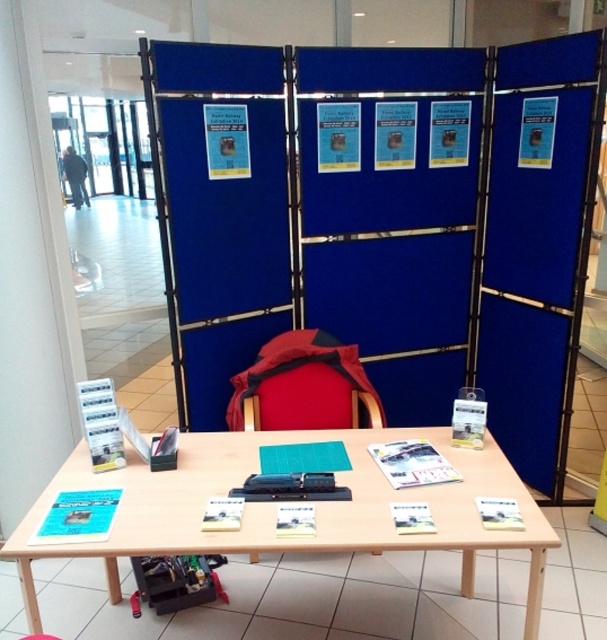
You are a visitor at the event and need to sit down. You see a red fabric chair at center and a pink plastic stool at lower center. Which one is positioned higher from the ground?

The red fabric chair at center is located above the pink plastic stool at lower center, so the red fabric chair at center is higher from the ground.

You are a person who wants to sit down to read the brochures on the table. Which seat, the red fabric chair at center or the pink plastic stool at lower center, would be more comfortable for sitting at the table?

The red fabric chair at center is taller than the pink plastic stool at lower center, so it may provide a more comfortable seating height to reach the table.

You are a visitor at the exhibition hall and want to sit down to look at the items on the wooden table at center. Is the pink plastic stool at lower center positioned in a way that you can easily reach the table from the stool?

The wooden table at center is located above the pink plastic stool at lower center, meaning the stool is positioned directly under the table. This placement allows easy access to the table from the stool.